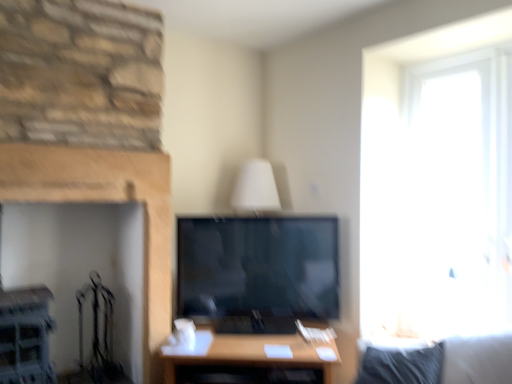
This screenshot has width=512, height=384. What do you see at coordinates (250, 360) in the screenshot?
I see `wooden table at center` at bounding box center [250, 360].

Locate an element on the screen. Image resolution: width=512 pixels, height=384 pixels. wooden table at center is located at coordinates (250, 360).

What is the approximate height of wooden table at center?

The height of wooden table at center is 16.38 inches.

Find the location of a particular element. smooth stone fireplace at left is located at coordinates (104, 201).

This screenshot has height=384, width=512. What do you see at coordinates (104, 201) in the screenshot? I see `smooth stone fireplace at left` at bounding box center [104, 201].

What are the coordinates of `wooden table at center` in the screenshot? It's located at (250, 360).

Which is more to the left, wooden table at center or smooth stone fireplace at left?

smooth stone fireplace at left is more to the left.

Which object is further away from the camera, wooden table at center or smooth stone fireplace at left?

Positioned behind is wooden table at center.

Which point is more distant from viewer, (302, 357) or (85, 169)?

The point (85, 169) is farther.

From the image's perspective, is wooden table at center under smooth stone fireplace at left?

Indeed, from the image's perspective, wooden table at center is shown beneath smooth stone fireplace at left.

From a real-world perspective, is wooden table at center physically above smooth stone fireplace at left?

No, from a real-world perspective, wooden table at center is not above smooth stone fireplace at left.

Which object is thinner, wooden table at center or smooth stone fireplace at left?

With smaller width is smooth stone fireplace at left.

Which of these two, wooden table at center or smooth stone fireplace at left, stands taller?

With more height is smooth stone fireplace at left.

Does wooden table at center have a larger size compared to smooth stone fireplace at left?

Correct, wooden table at center is larger in size than smooth stone fireplace at left.

Which is correct: wooden table at center is inside smooth stone fireplace at left, or outside of it?

wooden table at center cannot be found inside smooth stone fireplace at left.

Would you say wooden table at center is a long distance from smooth stone fireplace at left?

Actually, wooden table at center and smooth stone fireplace at left are a little close together.

Is wooden table at center positioned with its back to smooth stone fireplace at left?

No, wooden table at center is not facing away from smooth stone fireplace at left.

Identify the location of fireplace located in front of the wooden table at center. This screenshot has height=384, width=512. (104, 201).

Considering the positions of objects smooth stone fireplace at left and wooden table at center in the image provided, who is more to the right, smooth stone fireplace at left or wooden table at center?

Positioned to the right is wooden table at center.

Is smooth stone fireplace at left closer to the viewer compared to wooden table at center?

Yes, smooth stone fireplace at left is closer to the viewer.

Between point (7, 185) and point (242, 343), which one is positioned in front?

Point (7, 185)

From the image's perspective, which is above, smooth stone fireplace at left or wooden table at center?

smooth stone fireplace at left.

In the scene shown: From a real-world perspective, is smooth stone fireplace at left above or below wooden table at center?

smooth stone fireplace at left is situated higher than wooden table at center in the real world.

Can you confirm if smooth stone fireplace at left is wider than wooden table at center?

No, smooth stone fireplace at left is not wider than wooden table at center.

Considering the sizes of objects smooth stone fireplace at left and wooden table at center in the image provided, who is shorter, smooth stone fireplace at left or wooden table at center?

Standing shorter between the two is wooden table at center.

Can you confirm if smooth stone fireplace at left is bigger than wooden table at center?

Incorrect, smooth stone fireplace at left is not larger than wooden table at center.

Is smooth stone fireplace at left inside the boundaries of wooden table at center, or outside?

smooth stone fireplace at left is outside wooden table at center.

Is smooth stone fireplace at left touching wooden table at center?

No, smooth stone fireplace at left is not beside wooden table at center.

Could you tell me if smooth stone fireplace at left is turned towards wooden table at center?

No, smooth stone fireplace at left is not aimed at wooden table at center.

How different are the orientations of smooth stone fireplace at left and wooden table at center in degrees?

There is a 42.4-degree angle between the facing directions of smooth stone fireplace at left and wooden table at center.

Where is `fireplace in front of the wooden table at center`? fireplace in front of the wooden table at center is located at coordinates (104, 201).

Where is `fireplace in front of the wooden table at center`? Image resolution: width=512 pixels, height=384 pixels. fireplace in front of the wooden table at center is located at coordinates click(x=104, y=201).

The width and height of the screenshot is (512, 384). Identify the location of fireplace above the wooden table at center (from the image's perspective). (104, 201).